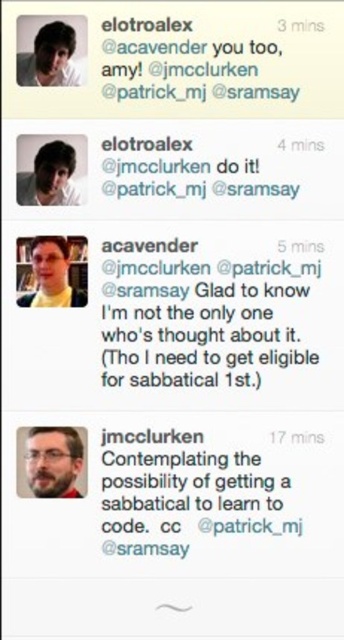
Between black matte tweet at upper center and bearded man at center, which one appears on the left side from the viewer's perspective?

Positioned to the left is bearded man at center.

Measure the distance between black matte tweet at upper center and camera.

black matte tweet at upper center is 1.14 meters from camera.

Where is `black matte tweet at upper center`? Image resolution: width=344 pixels, height=640 pixels. black matte tweet at upper center is located at coordinates (186, 64).

The height and width of the screenshot is (640, 344). What do you see at coordinates (186, 64) in the screenshot? I see `black matte tweet at upper center` at bounding box center [186, 64].

Is point (116, 65) positioned in front of point (51, 72)?

That is False.

Who is more forward, (112, 42) or (59, 60)?

Point (59, 60)

The height and width of the screenshot is (640, 344). Identify the location of black matte tweet at upper center. (x=186, y=64).

Is white matte tweet at center bigger than matte black face at upper left?

Yes, white matte tweet at center is bigger than matte black face at upper left.

Is the position of white matte tweet at center less distant than that of matte black face at upper left?

No.

Where is `white matte tweet at center`? This screenshot has height=640, width=344. white matte tweet at center is located at coordinates (209, 312).